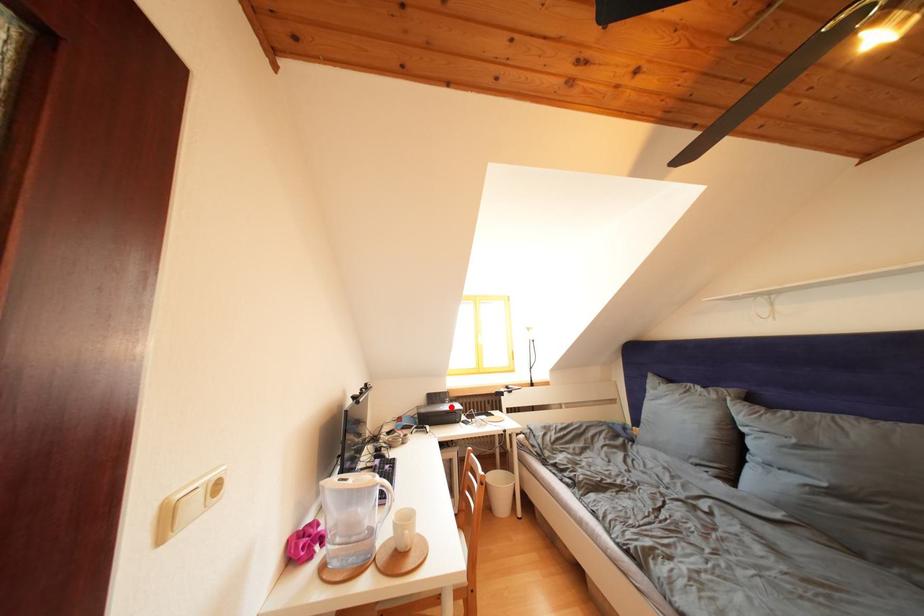
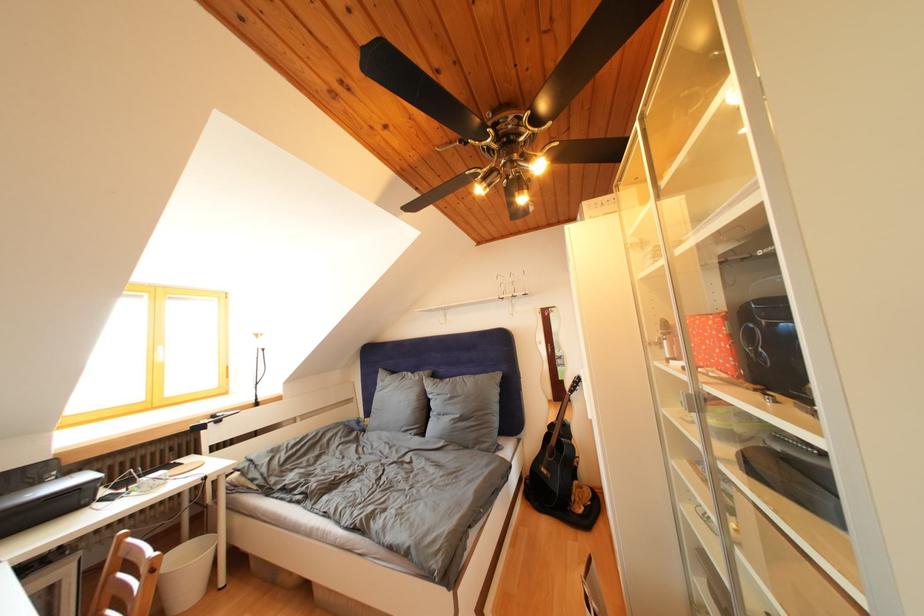
The point at the highlighted location is marked in the first image. Where is the corresponding point in the second image?

(44, 488)